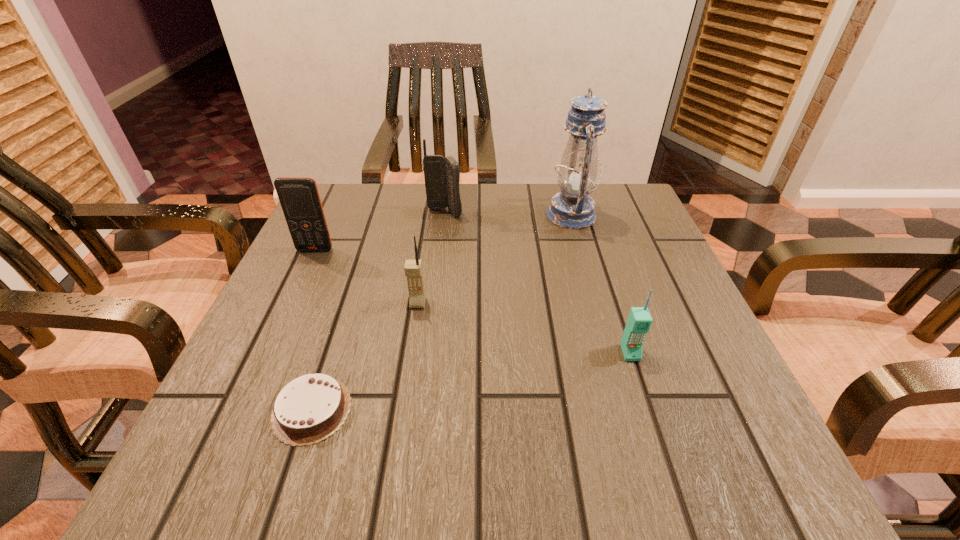
At what (x,y) coordinates should I click in order to perform the action: click on cellular telephone present at the left edge. Please return your answer as a coordinate pair (x, y). The width and height of the screenshot is (960, 540). Looking at the image, I should click on [299, 197].

You are a GUI agent. You are given a task and a screenshot of the screen. Output one action in this format:
    pyautogui.click(x=<x>, y=<y>)
    Task: Click on the chocolate cake that is at the left edge
    The height and width of the screenshot is (540, 960).
    Given the screenshot: What is the action you would take?
    pyautogui.click(x=309, y=409)

This screenshot has height=540, width=960. Identify the location of lantern that is positioned at the right edge. coord(572,208).

Where is `cellular telephone that is positioned at the right edge`? The width and height of the screenshot is (960, 540). cellular telephone that is positioned at the right edge is located at coordinates (639, 321).

At what (x,y) coordinates should I click in order to perform the action: click on object that is at the near left corner. Please return your answer as a coordinate pair (x, y). Image resolution: width=960 pixels, height=540 pixels. Looking at the image, I should click on (309, 409).

The width and height of the screenshot is (960, 540). Identify the location of object located at the far right corner. (572, 208).

The height and width of the screenshot is (540, 960). What are the coordinates of `vacant space at the far edge` in the screenshot? It's located at (499, 204).

The image size is (960, 540). In order to click on vacant space at the near edge of the desktop in this screenshot , I will do `click(344, 426)`.

This screenshot has height=540, width=960. I want to click on free space at the left edge, so click(x=265, y=379).

Find the location of `blank space at the right edge of the desktop`. blank space at the right edge of the desktop is located at coordinates (612, 241).